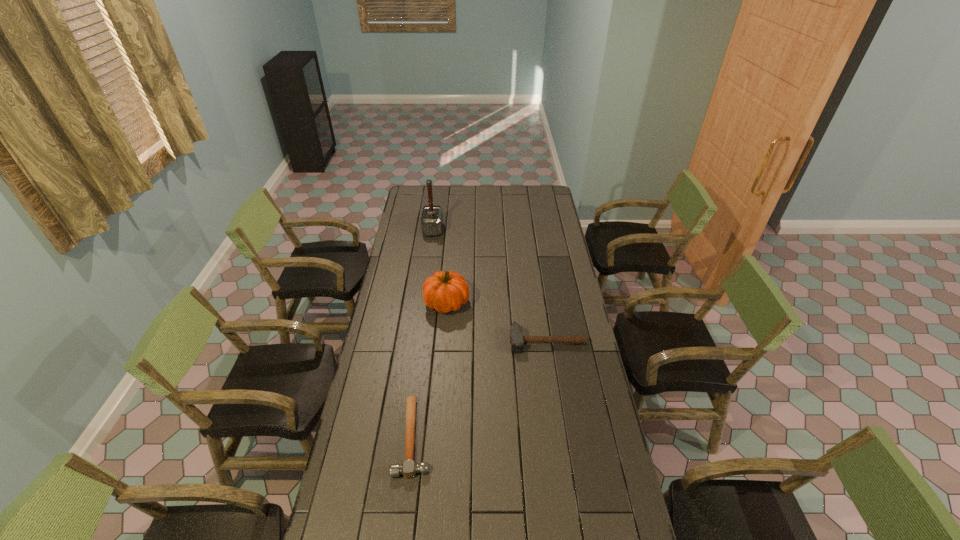
Identify the location of the farthest hammer. (432, 217).

Find the location of a particular element. This screenshot has height=540, width=960. the tallest hammer is located at coordinates (432, 217).

This screenshot has height=540, width=960. Identify the location of pumpkin. (444, 291).

You are a GUI agent. You are given a task and a screenshot of the screen. Output one action in this format:
    pyautogui.click(x=<x>, y=<y>)
    Task: Click on the second tallest object
    This screenshot has width=960, height=540.
    Given the screenshot: What is the action you would take?
    pyautogui.click(x=444, y=291)

Identify the location of the third farthest object. This screenshot has width=960, height=540. (517, 340).

I want to click on the rightmost object, so click(517, 340).

The height and width of the screenshot is (540, 960). In order to click on the nearest object in this screenshot , I will do `click(409, 468)`.

Find the location of a particular element. This screenshot has height=540, width=960. the shortest hammer is located at coordinates (409, 468).

Where is `free space located 0.050m on the front of the farthest hammer`? The image size is (960, 540). free space located 0.050m on the front of the farthest hammer is located at coordinates tap(431, 244).

This screenshot has height=540, width=960. Identify the location of free space located on the back of the pumpkin. (451, 246).